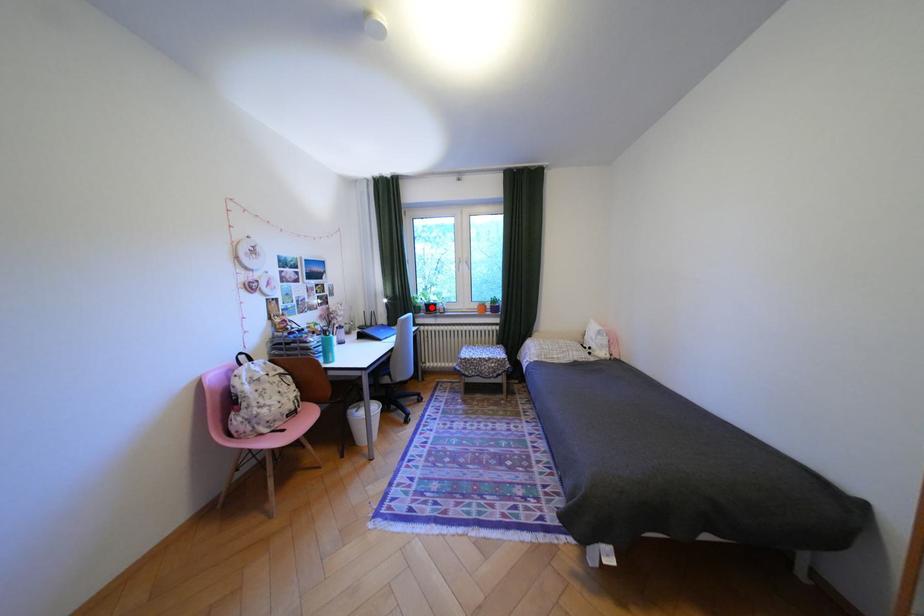
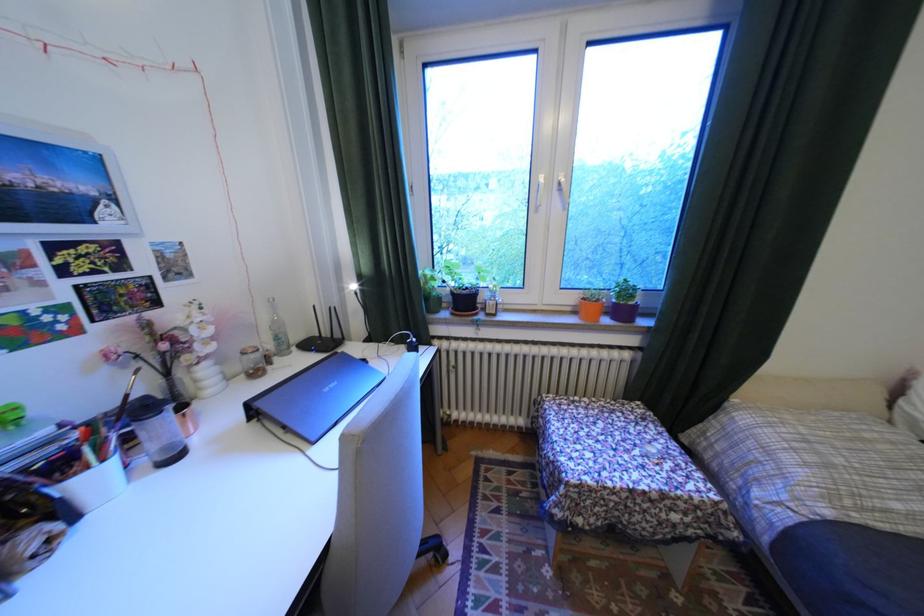
Where in the second image is the point corresponding to the highlighted location from the first image?

(451, 299)